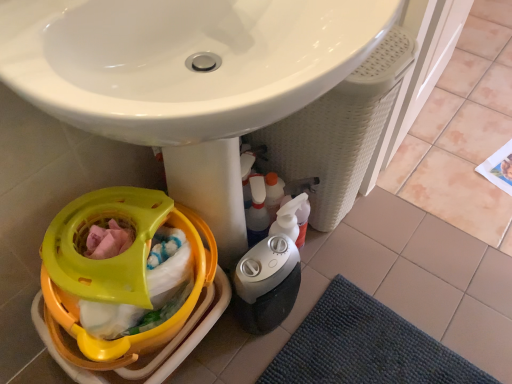
Identify the location of translucent plastic spray bottle at lower center. The width and height of the screenshot is (512, 384). (257, 211).

The image size is (512, 384). Describe the element at coordinates (130, 282) in the screenshot. I see `yellow plastic baby carriage at lower left` at that location.

I want to click on gray plastic humidifier at lower center, so click(x=266, y=284).

Measure the distance between beige tile at lower right and gray plastic humidifier at lower center.

beige tile at lower right and gray plastic humidifier at lower center are 32.86 inches apart from each other.

From the picture: Is beige tile at lower right not within gray plastic humidifier at lower center?

Yes.

From the picture: Between beige tile at lower right and gray plastic humidifier at lower center, which one is positioned in front?

Positioned in front is gray plastic humidifier at lower center.

From the image's perspective, is beige tile at lower right located above or below gray plastic humidifier at lower center?

Based on their image positions, beige tile at lower right is located above gray plastic humidifier at lower center.

Considering the sizes of objects gray plastic humidifier at lower center and yellow plastic baby carriage at lower left in the image provided, who is shorter, gray plastic humidifier at lower center or yellow plastic baby carriage at lower left?

yellow plastic baby carriage at lower left is shorter.

In the scene shown: Are gray plastic humidifier at lower center and yellow plastic baby carriage at lower left beside each other?

gray plastic humidifier at lower center and yellow plastic baby carriage at lower left are not in contact.

Which is less distant, (267, 254) or (195, 258)?

The point (195, 258) is closer.

The image size is (512, 384). I want to click on baby carriage above the gray plastic humidifier at lower center (from a real-world perspective), so click(x=130, y=282).

Which is more to the right, yellow plastic baby carriage at lower left or dark blue textured bath mat at lower right?

dark blue textured bath mat at lower right is more to the right.

Does yellow plastic baby carriage at lower left have a lesser width compared to dark blue textured bath mat at lower right?

Yes, yellow plastic baby carriage at lower left is thinner than dark blue textured bath mat at lower right.

How many degrees apart are the facing directions of yellow plastic baby carriage at lower left and dark blue textured bath mat at lower right?

There is a 90-degree angle between the facing directions of yellow plastic baby carriage at lower left and dark blue textured bath mat at lower right.

Is yellow plastic baby carriage at lower left looking in the opposite direction of dark blue textured bath mat at lower right?

yellow plastic baby carriage at lower left is not turned away from dark blue textured bath mat at lower right.

Does yellow plastic baby carriage at lower left have a smaller size compared to white glossy sink at center?

Indeed, yellow plastic baby carriage at lower left has a smaller size compared to white glossy sink at center.

From a real-world perspective, is yellow plastic baby carriage at lower left physically above white glossy sink at center?

No, from a real-world perspective, yellow plastic baby carriage at lower left is not over white glossy sink at center

Considering the positions of objects yellow plastic baby carriage at lower left and white glossy sink at center in the image provided, who is more to the left, yellow plastic baby carriage at lower left or white glossy sink at center?

Positioned to the left is yellow plastic baby carriage at lower left.

Considering the positions of objects yellow plastic baby carriage at lower left and white glossy sink at center in the image provided, who is in front, yellow plastic baby carriage at lower left or white glossy sink at center?

white glossy sink at center is in front.

Which object is closer to the camera, yellow plastic baby carriage at lower left or gray plastic humidifier at lower center?

yellow plastic baby carriage at lower left is more forward.

Would you say yellow plastic baby carriage at lower left contains gray plastic humidifier at lower center?

No, gray plastic humidifier at lower center is located outside of yellow plastic baby carriage at lower left.

How many degrees apart are the facing directions of yellow plastic baby carriage at lower left and gray plastic humidifier at lower center?

The angular difference between yellow plastic baby carriage at lower left and gray plastic humidifier at lower center is 0.837 degrees.

Locate an element on the screen. baby carriage located above the dark blue textured bath mat at lower right (from the image's perspective) is located at coordinates (130, 282).

Is yellow plastic baby carriage at lower left surrounded by dark blue textured bath mat at lower right?

No, yellow plastic baby carriage at lower left is not surrounded by dark blue textured bath mat at lower right.

Is dark blue textured bath mat at lower right touching yellow plastic baby carriage at lower left?

No, dark blue textured bath mat at lower right is not in contact with yellow plastic baby carriage at lower left.

Considering the relative sizes of translucent plastic spray bottle at lower center and dark blue textured bath mat at lower right in the image provided, is translucent plastic spray bottle at lower center shorter than dark blue textured bath mat at lower right?

No.

Looking at the image, does translucent plastic spray bottle at lower center seem bigger or smaller compared to dark blue textured bath mat at lower right?

translucent plastic spray bottle at lower center is smaller than dark blue textured bath mat at lower right.

How different are the orientations of translucent plastic spray bottle at lower center and dark blue textured bath mat at lower right in degrees?

47.8 degrees separate the facing orientations of translucent plastic spray bottle at lower center and dark blue textured bath mat at lower right.

Which of these two, translucent plastic spray bottle at lower center or dark blue textured bath mat at lower right, is wider?

dark blue textured bath mat at lower right.

The width and height of the screenshot is (512, 384). I want to click on appliance in front of the beige tile at lower right, so click(x=266, y=284).

The height and width of the screenshot is (384, 512). I want to click on appliance behind the yellow plastic baby carriage at lower left, so click(266, 284).

Considering their positions, is beige tile at lower right positioned further to yellow plastic baby carriage at lower left than translucent plastic spray bottle at lower center?

beige tile at lower right is further to yellow plastic baby carriage at lower left.

When comparing their distances from gray plastic humidifier at lower center, does translucent plastic spray bottle at lower center or yellow plastic baby carriage at lower left seem closer?

The object closer to gray plastic humidifier at lower center is translucent plastic spray bottle at lower center.

Which object lies further to the anchor point gray plastic humidifier at lower center, beige tile at lower right or dark blue textured bath mat at lower right?

beige tile at lower right.

From the image, which object appears to be nearer to beige tile at lower right, dark blue textured bath mat at lower right or yellow plastic baby carriage at lower left?

dark blue textured bath mat at lower right lies closer to beige tile at lower right than the other object.

Considering their positions, is yellow plastic baby carriage at lower left positioned further to gray plastic humidifier at lower center than dark blue textured bath mat at lower right?

dark blue textured bath mat at lower right.

Looking at the image, which one is located closer to dark blue textured bath mat at lower right, beige tile at lower right or translucent plastic spray bottle at lower center?

Based on the image, translucent plastic spray bottle at lower center appears to be nearer to dark blue textured bath mat at lower right.

Looking at this image, when comparing their distances from beige tile at lower right, does white glossy sink at center or gray plastic humidifier at lower center seem further?

Based on the image, white glossy sink at center appears to be further to beige tile at lower right.

From the image, which object appears to be farther from translucent plastic spray bottle at lower center, dark blue textured bath mat at lower right or yellow plastic baby carriage at lower left?

Based on the image, dark blue textured bath mat at lower right appears to be further to translucent plastic spray bottle at lower center.

In order to click on bath mat between translucent plastic spray bottle at lower center and beige tile at lower right in the horizontal direction in this screenshot , I will do click(x=364, y=347).

Locate an element on the screen. This screenshot has height=384, width=512. cleaning product between white glossy sink at center and beige tile at lower right from left to right is located at coordinates (257, 211).

At what (x,y) coordinates should I click in order to perform the action: click on baby carriage positioned between white glossy sink at center and gray plastic humidifier at lower center from near to far. Please return your answer as a coordinate pair (x, y). This screenshot has height=384, width=512. Looking at the image, I should click on (130, 282).

Image resolution: width=512 pixels, height=384 pixels. Identify the location of appliance between translucent plastic spray bottle at lower center and beige tile at lower right. (266, 284).